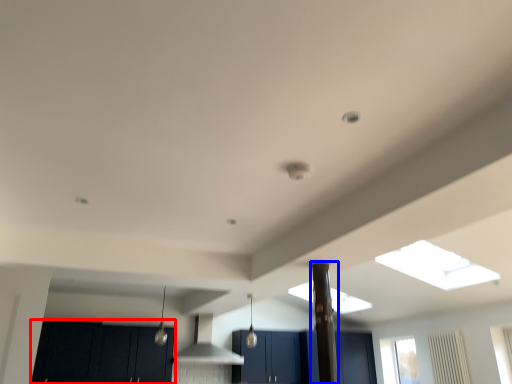
Question: Among these objects, which one is nearest to the camera, cabinetry (highlighted by a red box) or pillar (highlighted by a blue box)?

Choices:
 (A) cabinetry
 (B) pillar

Answer: (B)